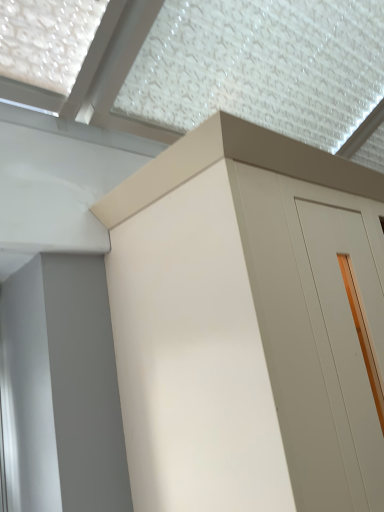
In order to click on matte white elevator at upper center in this screenshot , I will do `click(247, 324)`.

This screenshot has height=512, width=384. Describe the element at coordinates (247, 324) in the screenshot. I see `matte white elevator at upper center` at that location.

At what (x,y) coordinates should I click in order to perform the action: click on matte white elevator at upper center. Please return your answer as a coordinate pair (x, y). Looking at the image, I should click on (247, 324).